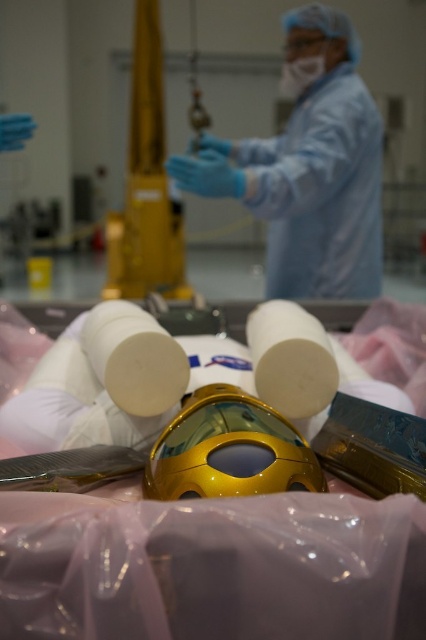
Question: Is metallic gold helmet at center above matte white mask at upper center?

Choices:
 (A) yes
 (B) no

Answer: (B)

Question: Is blue latex gloves at center positioned at the back of white matte toilet paper at center?

Choices:
 (A) yes
 (B) no

Answer: (A)

Question: Does metallic gold helmet at center have a lesser width compared to white matte toilet paper at center?

Choices:
 (A) yes
 (B) no

Answer: (B)

Question: Estimate the real-world distances between objects in this image. Which object is closer to the white matte toilet paper at center?

Choices:
 (A) matte white mask at upper center
 (B) blue latex gloves at center
 (C) metallic gold helmet at center

Answer: (C)

Question: Which object appears closest to the camera in this image?

Choices:
 (A) matte white mask at upper center
 (B) blue latex gloves at center
 (C) white matte toilet paper at center

Answer: (C)

Question: Which point appears closest to the camera in this image?

Choices:
 (A) (253, 484)
 (B) (281, 410)
 (C) (293, 81)
 (D) (288, 243)

Answer: (A)